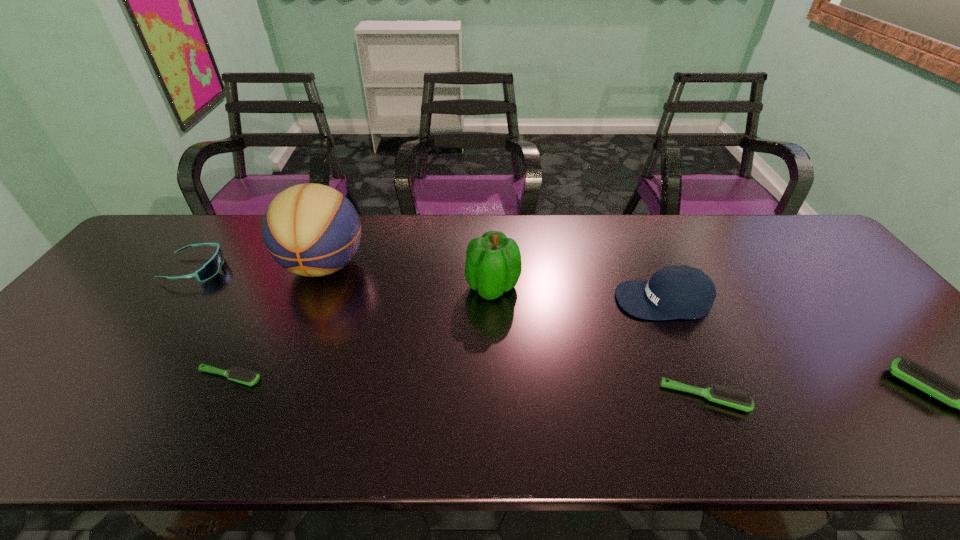
Locate an element on the screen. The width and height of the screenshot is (960, 540). free region located 0.060m on the right of the second hairbrush from left to right is located at coordinates click(x=773, y=397).

You are a GUI agent. You are given a task and a screenshot of the screen. Output one action in this format:
    pyautogui.click(x=<x>, y=<y>)
    Task: Click on the free region located on the front-facing side of the leftmost object
    This screenshot has width=960, height=540.
    Given the screenshot: What is the action you would take?
    pyautogui.click(x=261, y=269)

I want to click on free space located 0.110m on the right of the bell pepper, so tap(560, 287).

Find the location of a particular element. The height and width of the screenshot is (540, 960). free location located on the patterned surface of the tallest object is located at coordinates (279, 376).

In order to click on vacant space positioned 0.350m on the front-facing side of the baseball cap in this screenshot , I will do `click(486, 300)`.

Find the location of a particular element. free spot located on the front-facing side of the baseball cap is located at coordinates (534, 300).

Find the location of a particular element. free space located on the front-facing side of the baseball cap is located at coordinates (508, 300).

Locate an element on the screen. sunglasses positioned at the far edge is located at coordinates (211, 268).

What are the coordinates of `basketball positioned at the far edge` in the screenshot? It's located at (312, 230).

The width and height of the screenshot is (960, 540). I want to click on object situated at the left edge, so (x=211, y=268).